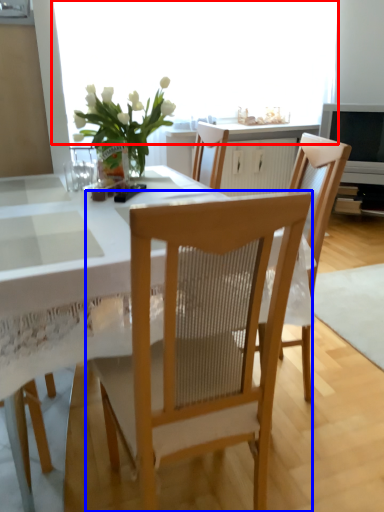
Question: Among these objects, which one is farthest to the camera, window screen (highlighted by a red box) or chair (highlighted by a blue box)?

Choices:
 (A) window screen
 (B) chair

Answer: (A)